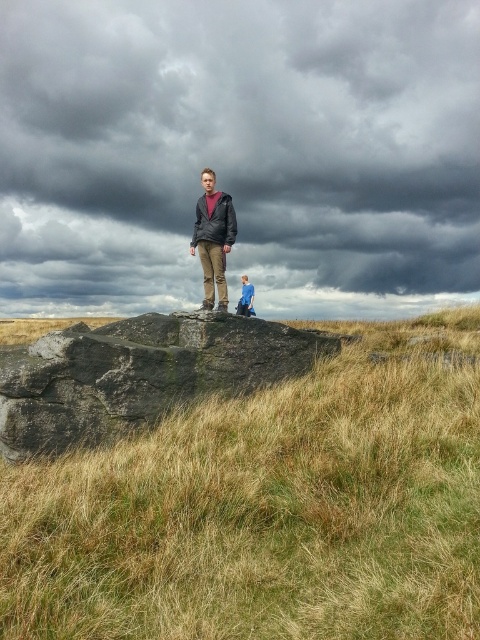
Question: Does dark gray stone boulder at center have a larger size compared to matte black jacket at center?

Choices:
 (A) no
 (B) yes

Answer: (B)

Question: Which object is farther from the camera taking this photo?

Choices:
 (A) dark gray cloudy sky at upper center
 (B) matte black jacket at center

Answer: (A)

Question: Does brown dry grass at center appear on the left side of blue denim jacket at center?

Choices:
 (A) yes
 (B) no

Answer: (B)

Question: Which of the following is the farthest from the observer?

Choices:
 (A) brown dry grass at center
 (B) dark gray cloudy sky at upper center

Answer: (B)

Question: Observing the image, what is the correct spatial positioning of dark gray cloudy sky at upper center in reference to matte black jacket at center?

Choices:
 (A) left
 (B) right

Answer: (A)

Question: Estimate the real-world distances between objects in this image. Which object is closer to the dark gray cloudy sky at upper center?

Choices:
 (A) brown dry grass at center
 (B) dark gray stone boulder at center
 (C) blue denim jacket at center
 (D) matte black jacket at center

Answer: (C)